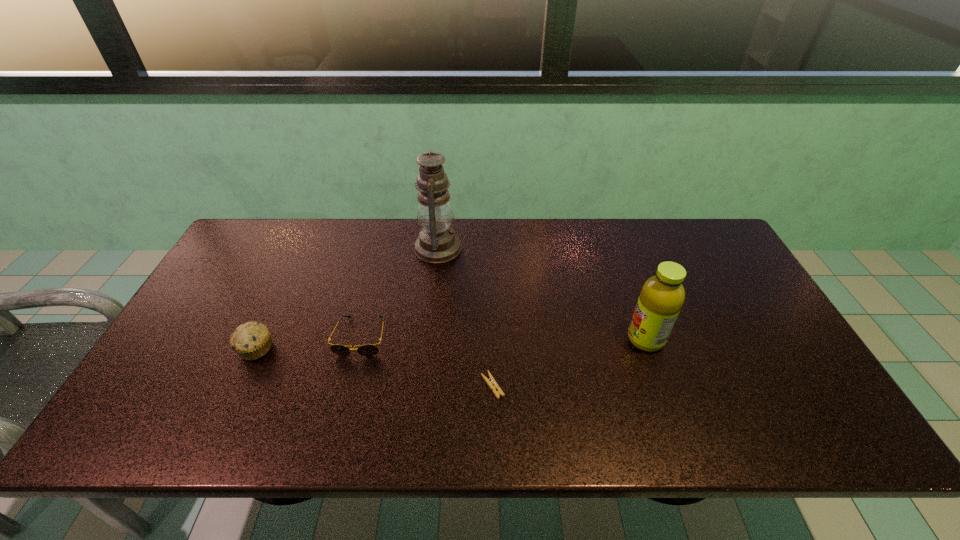
The image size is (960, 540). I want to click on vacant space situated on the left of the third object from left to right, so click(x=356, y=248).

You are a GUI agent. You are given a task and a screenshot of the screen. Output one action in this format:
    pyautogui.click(x=<x>, y=<y>)
    Task: Click on the free space located 0.190m on the front label of the rightmost object
    This screenshot has height=540, width=960.
    Given the screenshot: What is the action you would take?
    pyautogui.click(x=555, y=339)

Identify the location of blank area located on the front label of the rightmost object. The height and width of the screenshot is (540, 960). (596, 339).

Identify the location of free region located on the front label of the rightmost object. (608, 339).

At what (x,y) coordinates should I click in order to perform the action: click on blank space located on the back of the leftmost object. Please return your answer as a coordinate pair (x, y). This screenshot has height=540, width=960. Looking at the image, I should click on (302, 249).

The height and width of the screenshot is (540, 960). I want to click on vacant area situated 0.130m on the lenses of the second object from left to right, so click(345, 403).

You are a GUI agent. You are given a task and a screenshot of the screen. Output one action in this format:
    pyautogui.click(x=<x>, y=<y>)
    Task: Click on the vacant space located 0.220m on the back of the second object from right to left
    Image resolution: width=960 pixels, height=540 pixels.
    Given the screenshot: What is the action you would take?
    pyautogui.click(x=491, y=307)

Locate an element on the screen. This screenshot has height=540, width=960. object that is at the far edge is located at coordinates (437, 243).

Where is `vacant space at the far edge of the desktop`? This screenshot has height=540, width=960. vacant space at the far edge of the desktop is located at coordinates (341, 226).

Identify the location of free space at the near edge of the desktop. (262, 430).